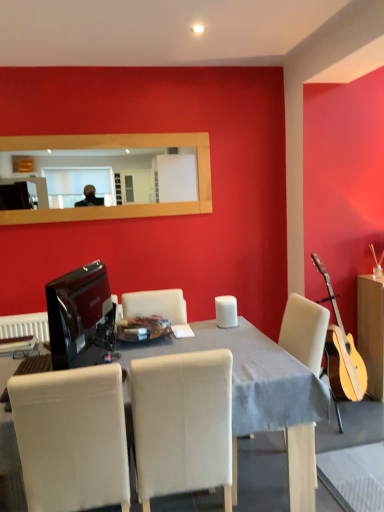
The width and height of the screenshot is (384, 512). In order to click on vacant space in front of white matte speaker at center in this screenshot , I will do pyautogui.click(x=225, y=337).